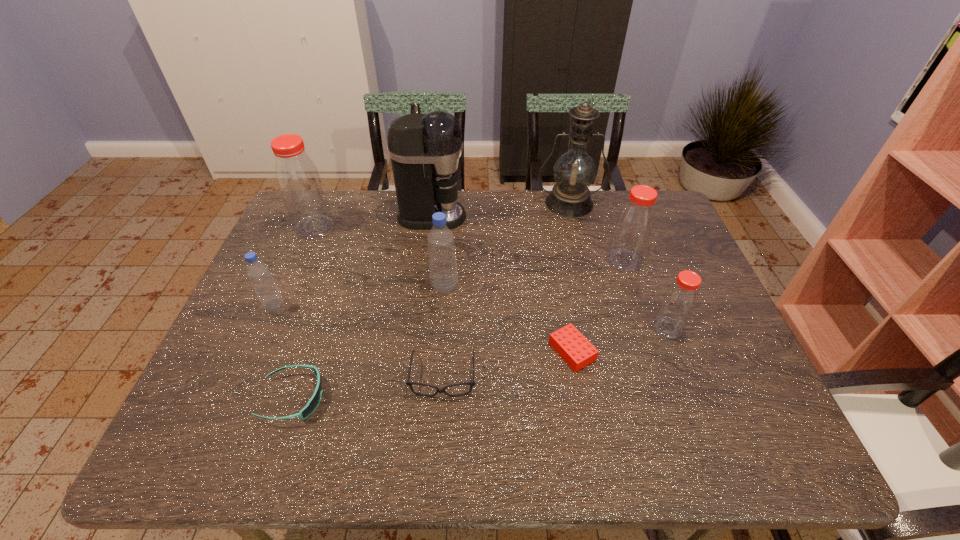
You are a GUI agent. You are given a task and a screenshot of the screen. Output one action in this format:
    pyautogui.click(x=<x>, y=<y>)
    Task: Click on the vacant space located on the left of the nearest red bottle
    Image resolution: width=960 pixels, height=540 pixels.
    Given the screenshot: What is the action you would take?
    pyautogui.click(x=533, y=328)

The height and width of the screenshot is (540, 960). What are the coordinates of `vacant region located 0.270m on the right of the fourth farthest bottle` in the screenshot? It's located at (387, 306).

Where is `vacant space located 0.130m on the front-facing side of the spectacles`? This screenshot has height=540, width=960. vacant space located 0.130m on the front-facing side of the spectacles is located at coordinates (438, 460).

Identify the location of vacant space situated 0.220m on the front-facing side of the sunglasses. The height and width of the screenshot is (540, 960). (424, 398).

This screenshot has height=540, width=960. What are the coordinates of `vacant space located 0.130m on the right of the Lego` in the screenshot? It's located at (648, 351).

At what (x,y) coordinates should I click in order to perform the action: click on oil lamp present at the far edge. Please return your answer as a coordinate pair (x, y). This screenshot has height=540, width=960. Looking at the image, I should click on (574, 171).

This screenshot has width=960, height=540. What are the coordinates of `coffee maker that is positioned at the far edge` in the screenshot? It's located at (425, 150).

Where is `bottle located in the far edge section of the desktop`? The image size is (960, 540). bottle located in the far edge section of the desktop is located at coordinates (299, 182).

Locate an element on the screen. This screenshot has width=960, height=540. object situated at the near edge is located at coordinates (313, 403).

This screenshot has height=540, width=960. In order to click on sunglasses located at the left edge in this screenshot , I will do `click(313, 403)`.